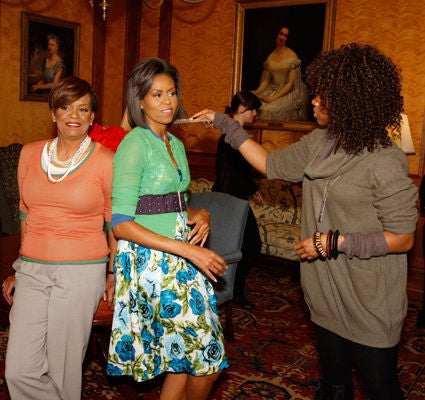
Image resolution: width=425 pixels, height=400 pixels. I want to click on left rear leg of armchair, so click(x=230, y=324).